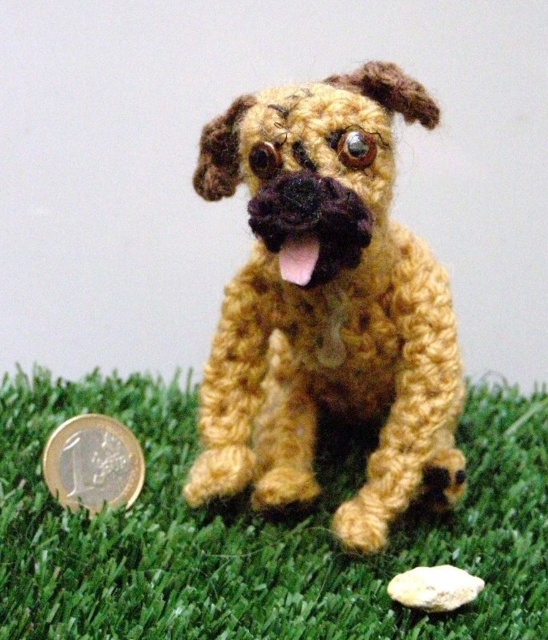
Between green yarn grass at lower center and gold metallic coin at lower left, which one is positioned lower?

green yarn grass at lower center is lower down.

Based on the photo, how much distance is there between green yarn grass at lower center and gold metallic coin at lower left?

green yarn grass at lower center and gold metallic coin at lower left are 8.36 inches apart.

Between point (141, 545) and point (134, 492), which one is positioned in front?

Point (141, 545)

Image resolution: width=548 pixels, height=640 pixels. In order to click on green yarn grass at lower center in this screenshot , I will do `click(259, 531)`.

Who is taller, green yarn grass at lower center or yarn crocheted dog at center?

yarn crocheted dog at center

Where is `green yarn grass at lower center`? green yarn grass at lower center is located at coordinates (259, 531).

Locate an element on the screen. green yarn grass at lower center is located at coordinates (259, 531).

Does point (379, 333) come farther from viewer compared to point (98, 445)?

No, it is not.

Between yarn crocheted dog at center and gold metallic coin at lower left, which one appears on the right side from the viewer's perspective?

From the viewer's perspective, yarn crocheted dog at center appears more on the right side.

Locate an element on the screen. The image size is (548, 640). yarn crocheted dog at center is located at coordinates (327, 305).